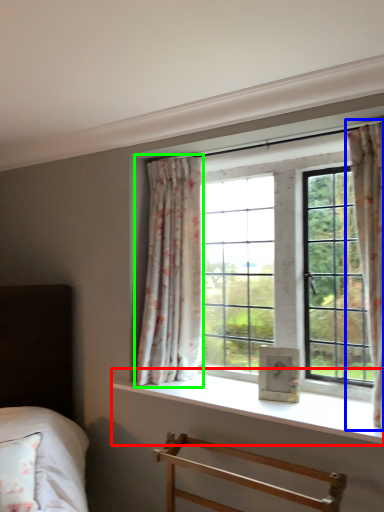
Question: Considering the real-world distances, which object is closest to window sill (highlighted by a red box)? curtain (highlighted by a blue box) or curtain (highlighted by a green box).

Choices:
 (A) curtain
 (B) curtain

Answer: (B)